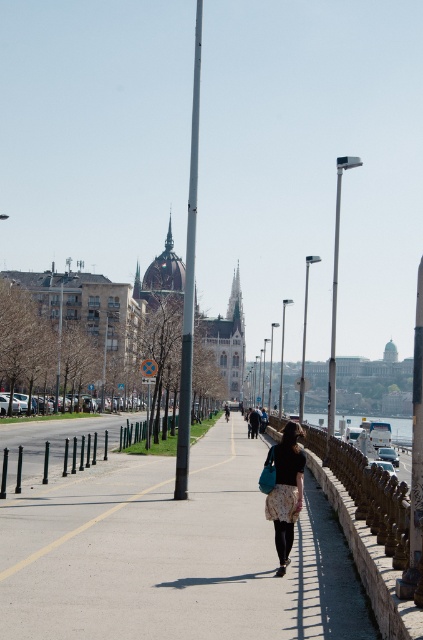
Question: Does concrete sidewalk at center appear on the left side of floral skirt at center?

Choices:
 (A) yes
 (B) no

Answer: (A)

Question: Can you confirm if concrete sidewalk at center is thinner than floral skirt at center?

Choices:
 (A) no
 (B) yes

Answer: (A)

Question: Does concrete sidewalk at center have a lesser width compared to floral skirt at center?

Choices:
 (A) yes
 (B) no

Answer: (B)